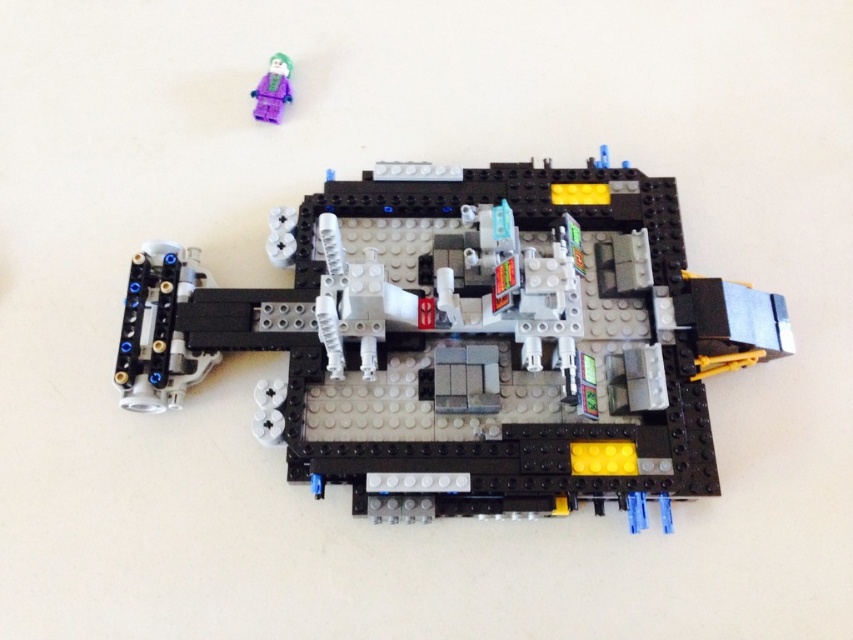
Question: In this image, where is black plastic vehicle at center located relative to purple matte minifigure at upper left?

Choices:
 (A) above
 (B) below

Answer: (B)

Question: Which point is closer to the camera?

Choices:
 (A) (582, 496)
 (B) (277, 72)

Answer: (A)

Question: Among these points, which one is nearest to the camera?

Choices:
 (A) (264, 120)
 (B) (683, 378)

Answer: (B)

Question: Is black plastic vehicle at center smaller than purple matte minifigure at upper left?

Choices:
 (A) no
 (B) yes

Answer: (A)

Question: Is black plastic vehicle at center to the right of purple matte minifigure at upper left from the viewer's perspective?

Choices:
 (A) yes
 (B) no

Answer: (A)